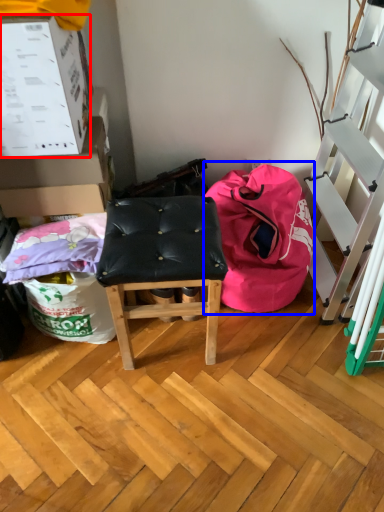
Question: Which of the following is the closest to the observer, box (highlighted by a red box) or bean bag chair (highlighted by a blue box)?

Choices:
 (A) box
 (B) bean bag chair

Answer: (A)